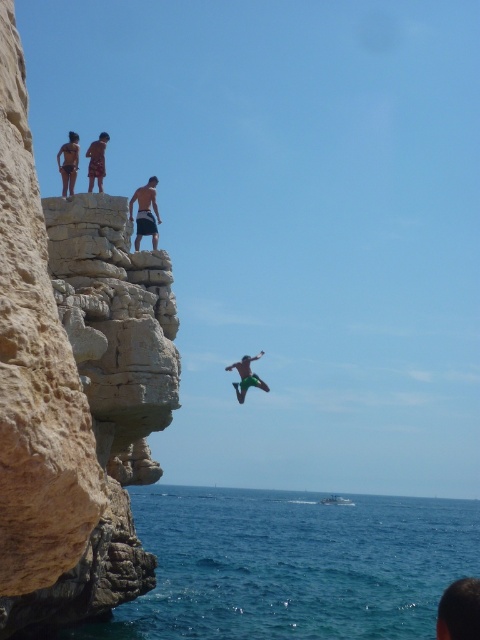
You are a safety officer at the cliff. You need to ensure that the distance between the dark blue shorts at upper center and the matte black shorts at upper left is at least 5 meters for safety. Is the current distance compliant with the safety requirement?

The dark blue shorts at upper center is 5.64 meters away from matte black shorts at upper left, which exceeds the required 5 meters, so it is compliant with the safety requirement.